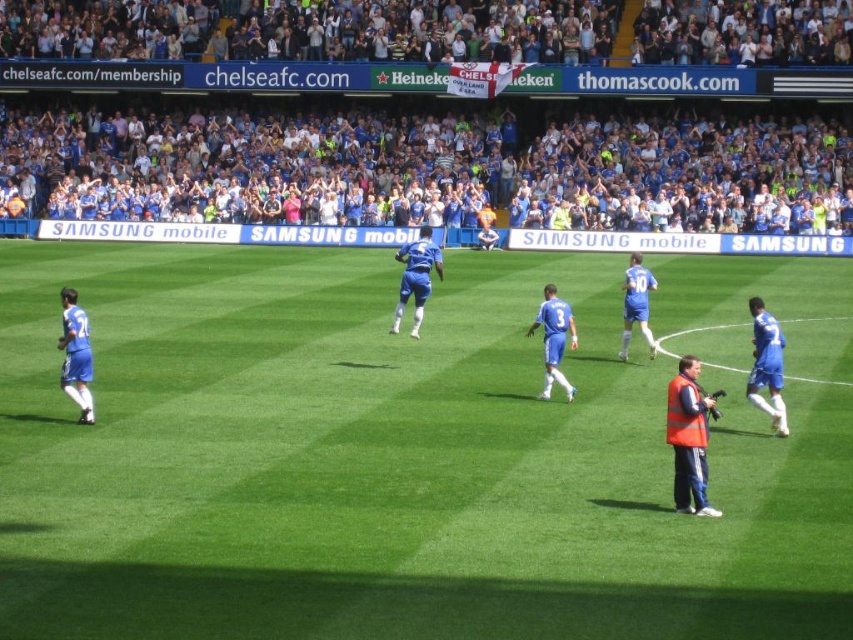
You are a photographer standing at the edge of the soccer field. You want to take a photo that includes both the point at coordinates point (x=720, y=513) and point (x=62, y=326). Which point should you focus on first to ensure both are in frame?

You should focus on point (x=720, y=513) first because it is closer to you than point (x=62, y=326), ensuring both points are within the camera frame.

You are a photographer standing at the camera position. You want to take a closeup photo of the point at coordinates point (619, 620). The zoom lens can focus on objects up to 30 feet away. Will you be able to capture the point clearly?

The point (619, 620) is 32.07 feet away from the camera. Since the zoom lens can only focus on objects up to 30 feet away, the photographer will not be able to capture the point clearly.

You are a photographer trying to capture a wide shot of the soccer match. You notice an orange reflective vest at lower right and a blue fabric jersey at left in your frame. Considering their sizes, which object would appear smaller in the photo?

The orange reflective vest at lower right would appear smaller in the photo because its width is less than the blue fabric jersey at left.